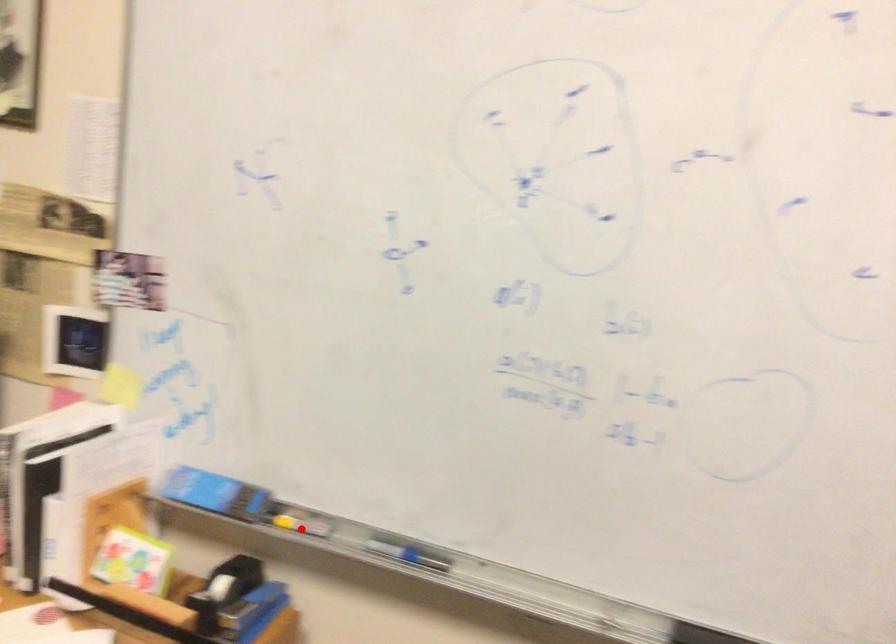
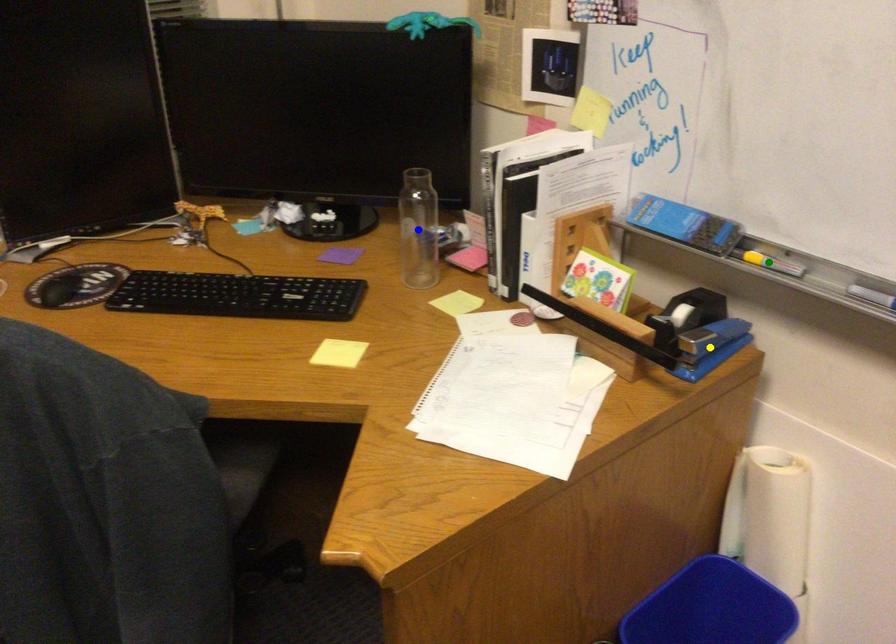
Question: I am providing you with two images of the same scene from different viewpoints. A red point is marked on the first image. You are given multiple points on the second image. Which point in image 2 represents the same 3d spot as the red point in image 1?

Choices:
 (A) blue point
 (B) green point
 (C) yellow point

Answer: (B)